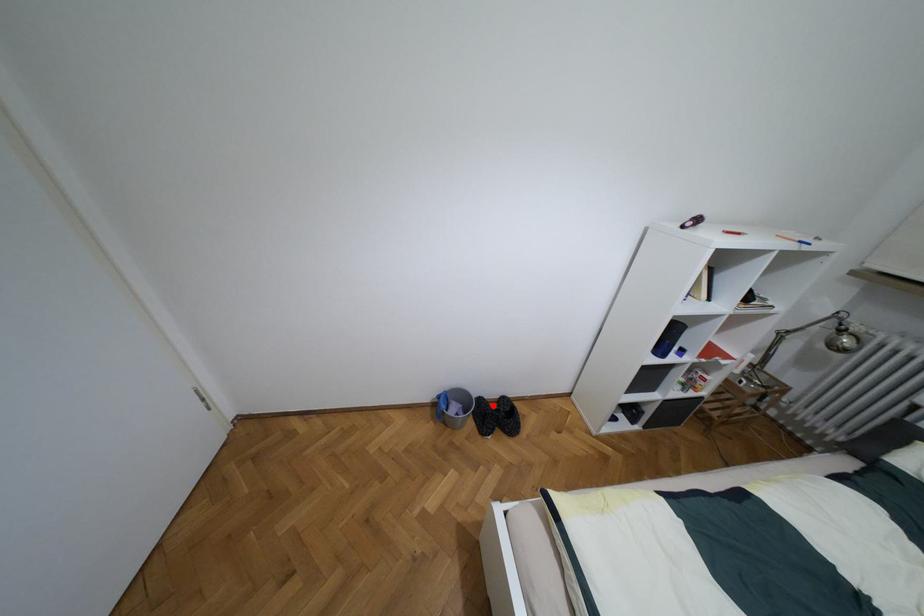
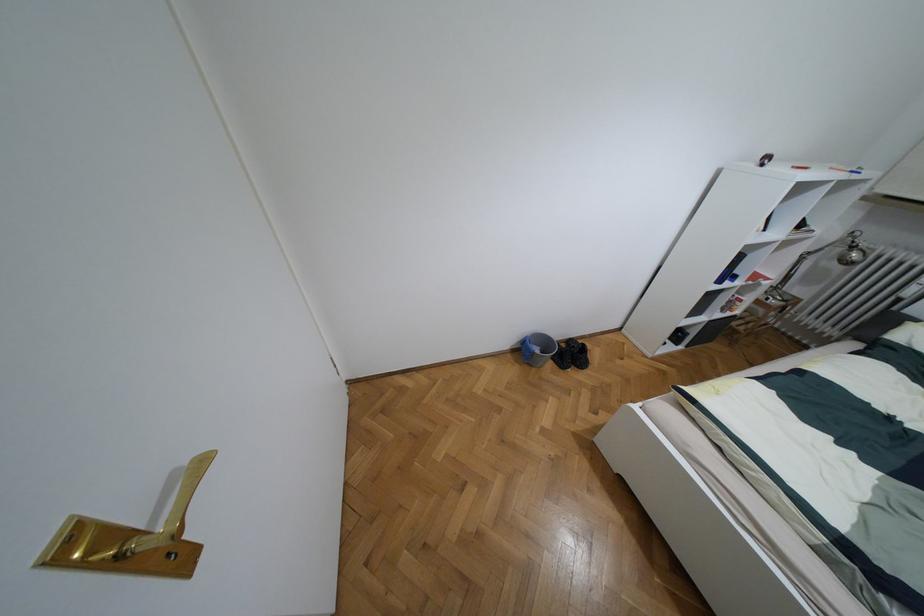
Question: I am providing you with two images of the same scene from different viewpoints. A red point is shown in image1. For the corresponding object point in image2, is it positioned nearer or farther from the camera?

Choices:
 (A) Nearer
 (B) Farther

Answer: (B)